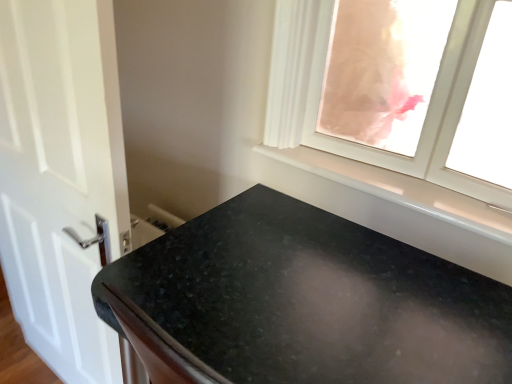
Question: Is black granite countertop at lower center positioned with its back to white glossy door at left?

Choices:
 (A) no
 (B) yes

Answer: (A)

Question: Is black granite countertop at lower center thinner than white glossy door at left?

Choices:
 (A) no
 (B) yes

Answer: (A)

Question: Can you confirm if black granite countertop at lower center is taller than white glossy door at left?

Choices:
 (A) no
 (B) yes

Answer: (A)

Question: Does black granite countertop at lower center have a greater width compared to white glossy door at left?

Choices:
 (A) no
 (B) yes

Answer: (B)

Question: Is black granite countertop at lower center bigger than white glossy door at left?

Choices:
 (A) yes
 (B) no

Answer: (A)

Question: From a real-world perspective, is black granite countertop at lower center above or below white glossy door at left?

Choices:
 (A) below
 (B) above

Answer: (A)

Question: Considering the positions of point (189, 288) and point (59, 218), is point (189, 288) closer or farther from the camera than point (59, 218)?

Choices:
 (A) closer
 (B) farther

Answer: (A)

Question: In terms of size, does black granite countertop at lower center appear bigger or smaller than white glossy door at left?

Choices:
 (A) small
 (B) big

Answer: (B)

Question: Visually, is black granite countertop at lower center positioned to the left or to the right of white glossy door at left?

Choices:
 (A) left
 (B) right

Answer: (B)

Question: Considering the relative positions of black granite countertop at lower center and white glossy window sill at upper right in the image provided, is black granite countertop at lower center to the left or to the right of white glossy window sill at upper right?

Choices:
 (A) left
 (B) right

Answer: (A)

Question: Considering the positions of point (212, 362) and point (284, 160), is point (212, 362) closer or farther from the camera than point (284, 160)?

Choices:
 (A) closer
 (B) farther

Answer: (A)

Question: From their relative heights in the image, would you say black granite countertop at lower center is taller or shorter than white glossy window sill at upper right?

Choices:
 (A) short
 (B) tall

Answer: (B)

Question: Considering their positions, is black granite countertop at lower center located in front of or behind white glossy window sill at upper right?

Choices:
 (A) behind
 (B) front

Answer: (B)

Question: From a real-world perspective, relative to black granite countertop at lower center, is white glossy window sill at upper right vertically above or below?

Choices:
 (A) above
 (B) below

Answer: (A)

Question: In terms of size, does white glossy window sill at upper right appear bigger or smaller than black granite countertop at lower center?

Choices:
 (A) small
 (B) big

Answer: (A)